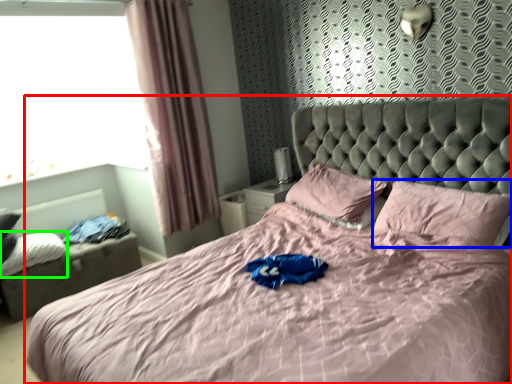
Question: Which object is the farthest from bed (highlighted by a red box)? Choose among these: pillow (highlighted by a blue box) or pillow (highlighted by a green box).

Choices:
 (A) pillow
 (B) pillow

Answer: (B)